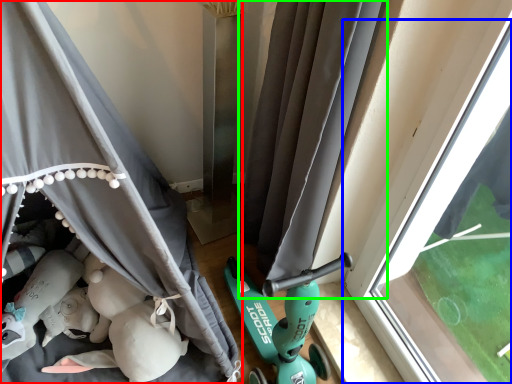
Question: Based on their relative distances, which object is nearer to curtain (highlighted by a red box)? Choose from window (highlighted by a blue box) and curtain (highlighted by a green box).

Choices:
 (A) window
 (B) curtain

Answer: (B)